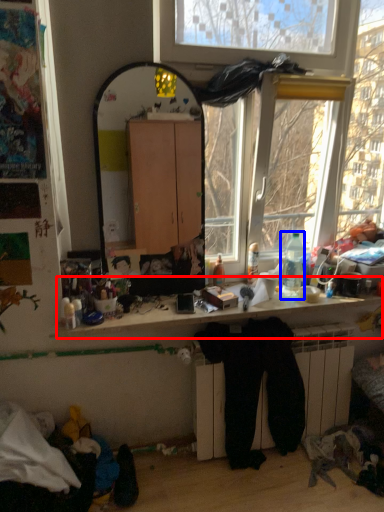
Question: Which object is further to the camera taking this photo, computer desk (highlighted by a red box) or bottle (highlighted by a blue box)?

Choices:
 (A) computer desk
 (B) bottle

Answer: (B)